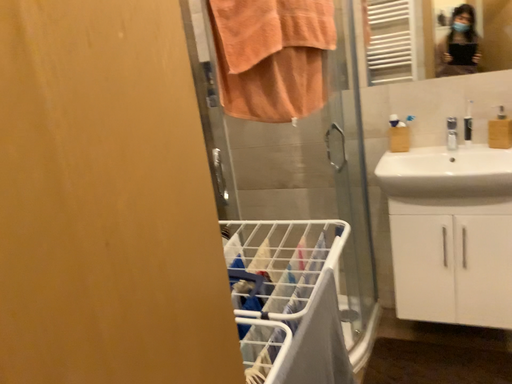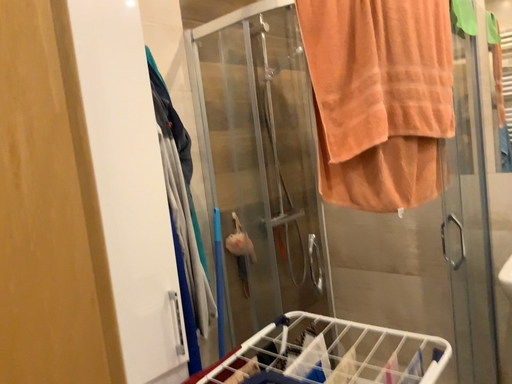
Question: Which way did the camera rotate in the video?

Choices:
 (A) rotated downward
 (B) rotated upward

Answer: (B)